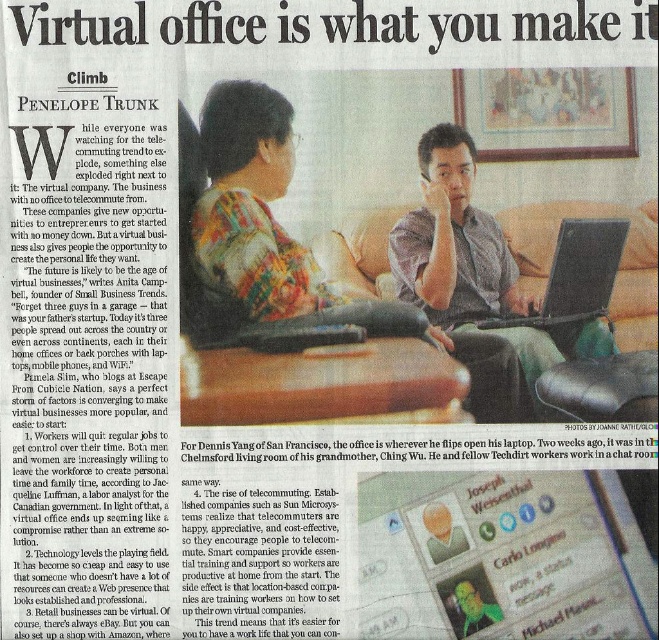
Does point (474, 252) come behind point (619, 230)?

That is True.

Can you confirm if matte gray shirt at center is positioned below black matte laptop at center?

Yes.

The width and height of the screenshot is (659, 640). In order to click on matte gray shirt at center in this screenshot , I will do (474, 284).